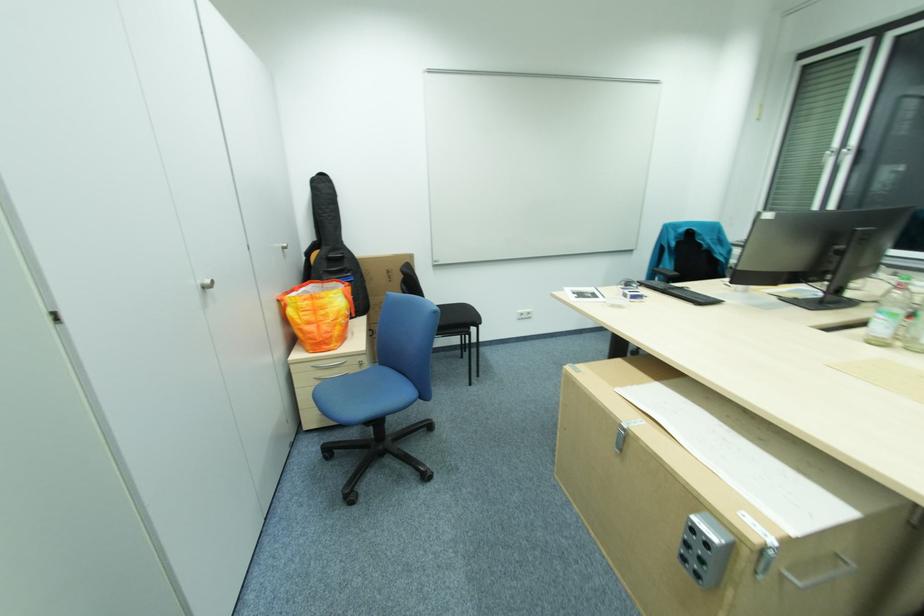
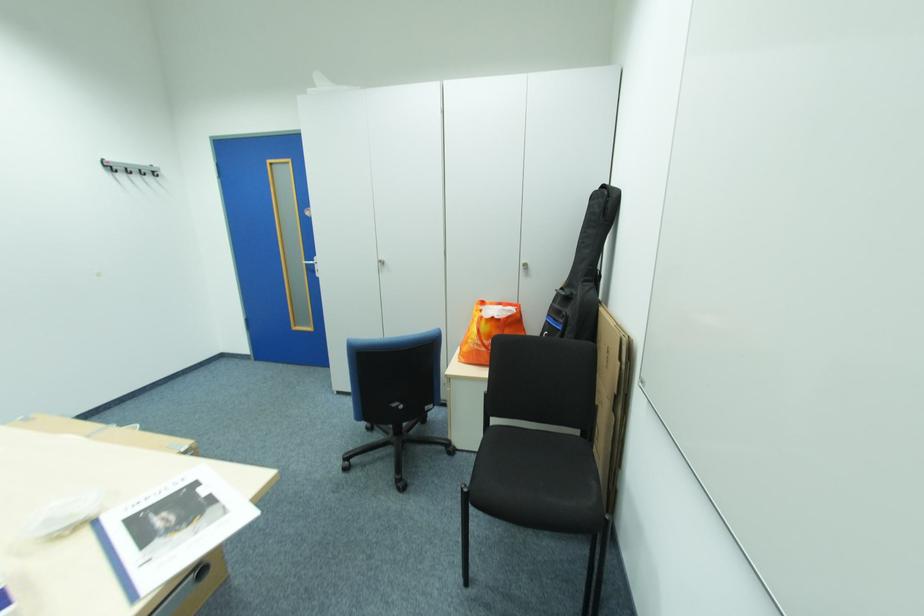
In the second image, find the point that corresponds to point 356,273 in the first image.

(572, 318)